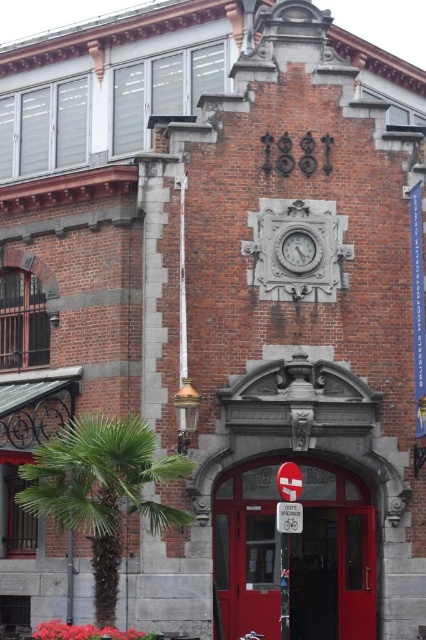
This screenshot has height=640, width=426. Describe the element at coordinates (288, 481) in the screenshot. I see `metallic reflective sign at center` at that location.

Where is `metallic reflective sign at center`? The height and width of the screenshot is (640, 426). metallic reflective sign at center is located at coordinates (288, 481).

Who is lower down, green leafy palm tree at left or white stone clock at center?

green leafy palm tree at left is below.

Can you confirm if green leafy palm tree at left is smaller than white stone clock at center?

No.

Is point (118, 444) more distant than point (299, 273)?

That is False.

Identify the location of green leafy palm tree at left. The image size is (426, 640). (101, 490).

Does green leafy palm tree at left appear under metallic reflective sign at center?

Yes.

Is green leafy palm tree at left positioned before metallic reflective sign at center?

Yes.

Who is more distant from viewer, (163, 483) or (284, 461)?

The point (284, 461) is more distant.

Identify the location of green leafy palm tree at left. (101, 490).